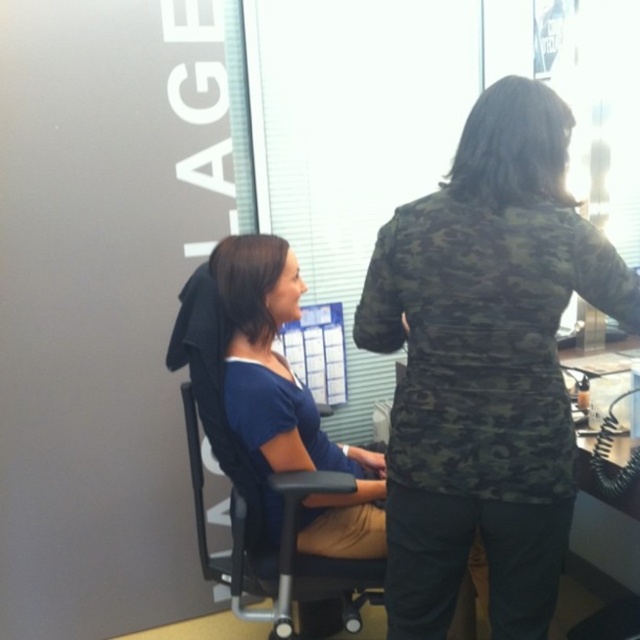
Question: Can you confirm if camo-patterned shirt at back is thinner than black plastic swivel chair at center?

Choices:
 (A) yes
 (B) no

Answer: (A)

Question: Where is camo-patterned shirt at back located in relation to black plastic swivel chair at center in the image?

Choices:
 (A) above
 (B) below

Answer: (A)

Question: Which point appears farthest from the camera in this image?

Choices:
 (A) (477, 278)
 (B) (192, 467)

Answer: (B)

Question: Among these points, which one is farthest from the camera?

Choices:
 (A) (380, 579)
 (B) (488, 323)

Answer: (A)

Question: Is camo-patterned shirt at back further to the viewer compared to black plastic swivel chair at center?

Choices:
 (A) yes
 (B) no

Answer: (B)